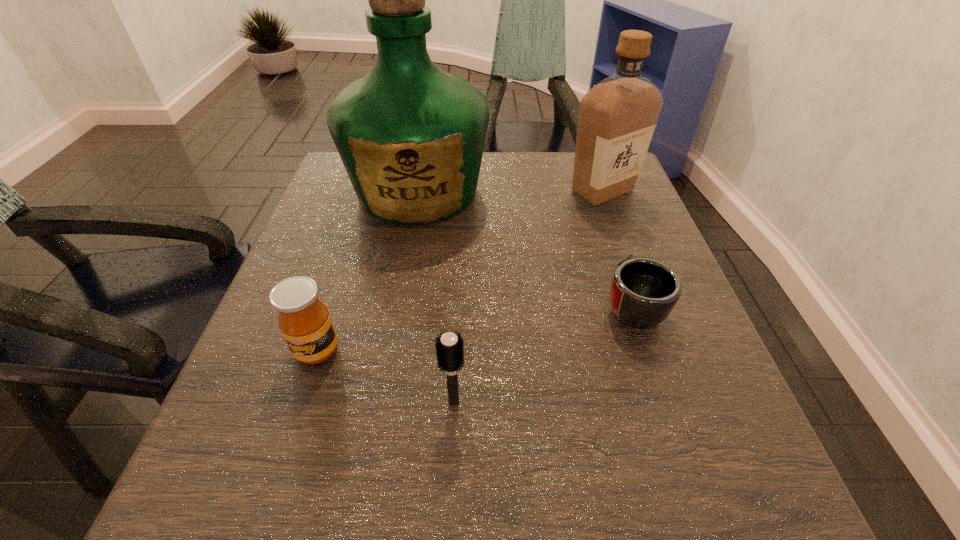
Where is `vacant area situated 0.150m on the front-facing side of the honey`? Image resolution: width=960 pixels, height=540 pixels. vacant area situated 0.150m on the front-facing side of the honey is located at coordinates (279, 467).

You are a GUI agent. You are given a task and a screenshot of the screen. Output one action in this format:
    pyautogui.click(x=<x>, y=<y>)
    Task: Click on the free space located 0.380m on the side of the shortest object with the handle
    Image resolution: width=960 pixels, height=540 pixels.
    Given the screenshot: What is the action you would take?
    pyautogui.click(x=588, y=172)

Where is `vacant area located on the side of the shortest object with the handle`? The width and height of the screenshot is (960, 540). vacant area located on the side of the shortest object with the handle is located at coordinates (613, 250).

Identify the location of free space located on the side of the shortest object with the handle. (614, 253).

Where is `liquor that is at the left edge`? This screenshot has height=540, width=960. liquor that is at the left edge is located at coordinates (411, 137).

Where is `honey that is at the left edge`? The height and width of the screenshot is (540, 960). honey that is at the left edge is located at coordinates (304, 320).

At what (x,y) coordinates should I click in order to perform the action: click on liquor at the right edge. Please return your answer as a coordinate pair (x, y). Looking at the image, I should click on (617, 117).

Where is `mug that is at the right edge`? The height and width of the screenshot is (540, 960). mug that is at the right edge is located at coordinates (643, 292).

The image size is (960, 540). Find the location of `object located in the far left corner section of the desktop`. object located in the far left corner section of the desktop is located at coordinates (411, 137).

Identify the location of object that is positioned at the far right corner. (617, 117).